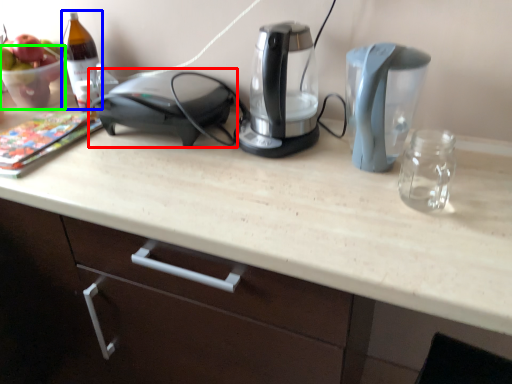
Question: Based on their relative distances, which object is farther from home appliance (highlighted by a red box)? Choose from wine bottle (highlighted by a blue box) and glass bowl (highlighted by a green box).

Choices:
 (A) wine bottle
 (B) glass bowl

Answer: (B)